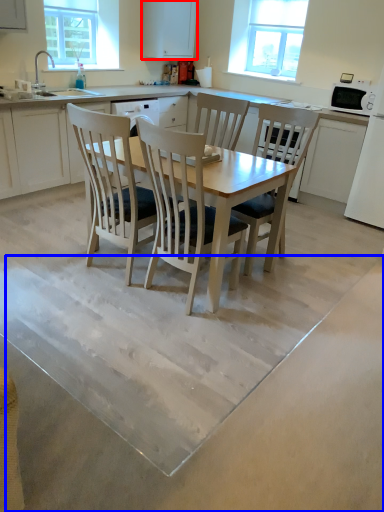
Question: Which object appears farthest to the camera in this image, cabinetry (highlighted by a red box) or concrete (highlighted by a blue box)?

Choices:
 (A) cabinetry
 (B) concrete

Answer: (A)